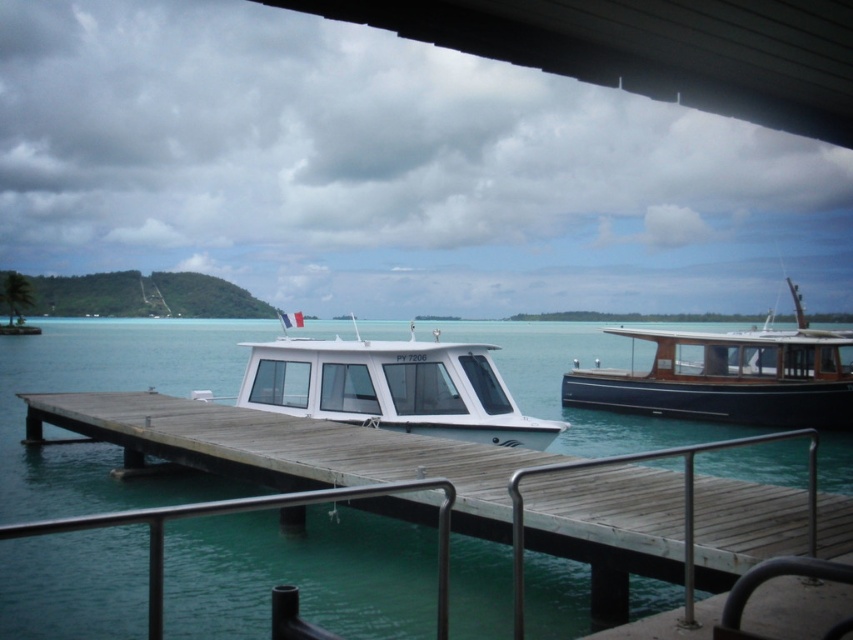
Question: Among these points, which one is farthest from the camera?

Choices:
 (A) (384, 381)
 (B) (786, 337)

Answer: (B)

Question: Which of the following is the farthest from the observer?

Choices:
 (A) white glossy boat at center
 (B) dark blue polished wood boat at right
 (C) clear blue water at center

Answer: (B)

Question: Does clear blue water at center appear under white glossy boat at center?

Choices:
 (A) yes
 (B) no

Answer: (A)

Question: Does clear blue water at center have a smaller size compared to white glossy boat at center?

Choices:
 (A) yes
 (B) no

Answer: (B)

Question: Among these points, which one is farthest from the camera?

Choices:
 (A) (288, 317)
 (B) (636, 396)
 (C) (33, 460)

Answer: (B)

Question: Is white glossy boat at center to the left of dark blue polished wood boat at right from the viewer's perspective?

Choices:
 (A) no
 (B) yes

Answer: (B)